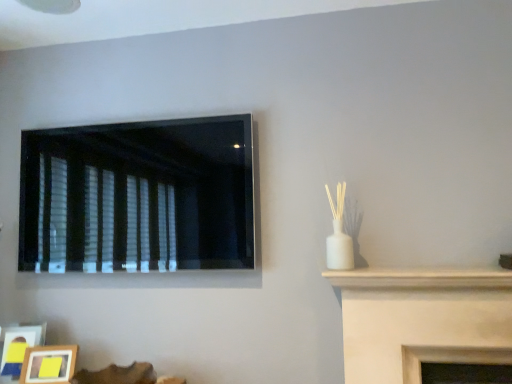
Question: From a real-world perspective, is black matte window at upper left positioned above or below wooden photo frame at lower left, the second picture frame when ordered from left to right?

Choices:
 (A) above
 (B) below

Answer: (A)

Question: In terms of size, does black matte window at upper left appear bigger or smaller than wooden photo frame at lower left, acting as the 1th picture frame starting from the right?

Choices:
 (A) big
 (B) small

Answer: (A)

Question: Which of these objects is positioned farthest from the wooden photo frame at lower left, acting as the 1th picture frame starting from the right?

Choices:
 (A) wooden picture frame at lower left, which ranks as the 2th picture frame in right-to-left order
 (B) black matte window at upper left

Answer: (B)

Question: Estimate the real-world distances between objects in this image. Which object is closer to the wooden photo frame at lower left, the second picture frame when ordered from left to right?

Choices:
 (A) wooden picture frame at lower left, which ranks as the 2th picture frame in right-to-left order
 (B) black matte window at upper left

Answer: (A)